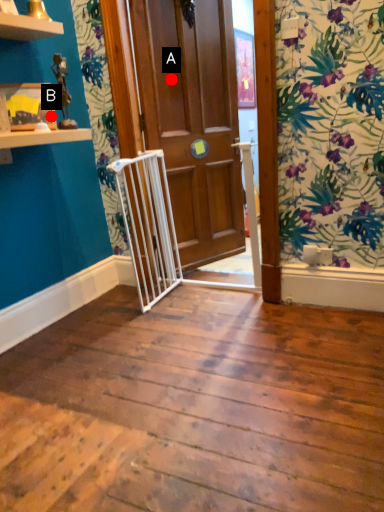
Question: Two points are circled on the image, labeled by A and B beside each circle. Which point appears closest to the camera in this image?

Choices:
 (A) A is closer
 (B) B is closer

Answer: (B)